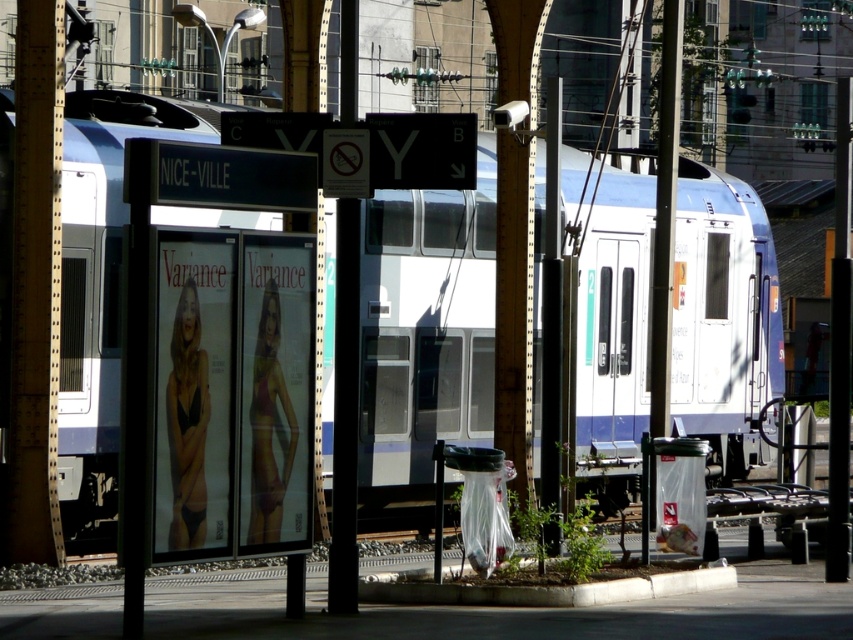
Where is `white glossy train at center`? white glossy train at center is located at coordinates (425, 324).

Find the location of a particular element. The width and height of the screenshot is (853, 640). white glossy train at center is located at coordinates pos(425,324).

Where is `white glossy train at center`? The height and width of the screenshot is (640, 853). white glossy train at center is located at coordinates (425, 324).

Between white glossy train at center and metallic pole at center, which one is positioned lower?

white glossy train at center

Who is taller, white glossy train at center or metallic pole at center?

With more height is white glossy train at center.

The height and width of the screenshot is (640, 853). Identify the location of white glossy train at center. (425, 324).

Is metallic pole at center closer to camera compared to black metal pole at center?

Yes, metallic pole at center is in front of black metal pole at center.

Measure the distance between point (x=344, y=211) and camera.

The distance of point (x=344, y=211) from camera is 38.01 feet.

Who is more forward, (351,349) or (543,324)?

Point (351,349) is in front.

In order to click on metallic pole at center in this screenshot , I will do `click(345, 412)`.